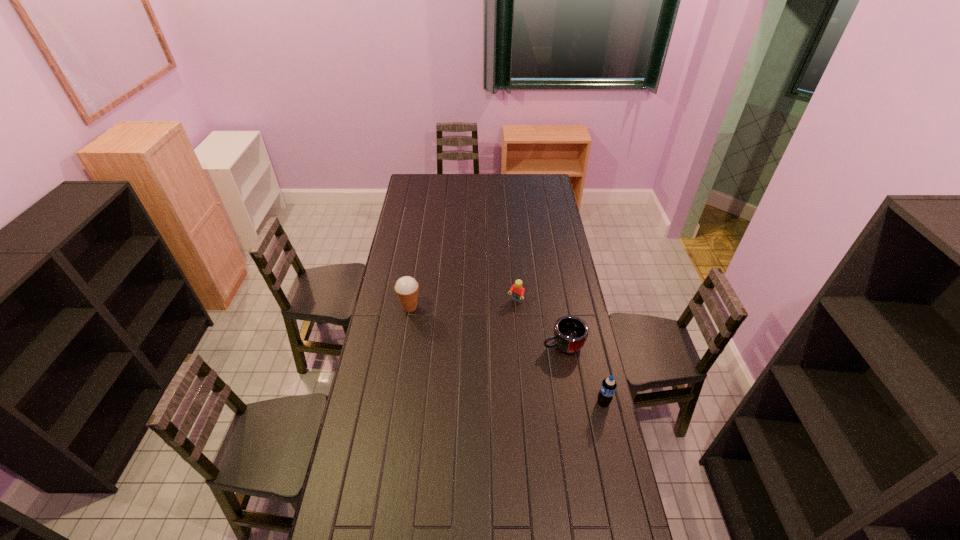
You are a GUI agent. You are given a task and a screenshot of the screen. Output one action in this format:
    pyautogui.click(x=<x>, y=<y>)
    Task: Click on the object that can be found as the second closest to the leftmost object
    This screenshot has height=540, width=960.
    Given the screenshot: What is the action you would take?
    point(570,332)

Locate an element on the screen. The image size is (960, 540). free spot that satisfies the following two spatial constraints: 1. on the front side of the icecream; 2. on the right side of the nearest object is located at coordinates (395, 402).

Image resolution: width=960 pixels, height=540 pixels. In order to click on vacant region that satisfies the following two spatial constraints: 1. on the front side of the mug; 2. on the left side of the nearest object in this screenshot , I will do `click(573, 402)`.